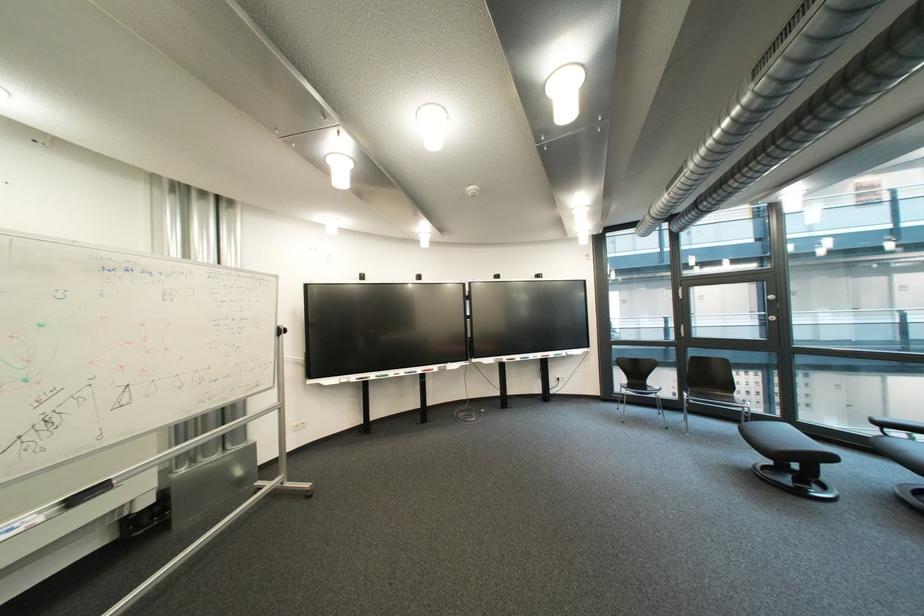
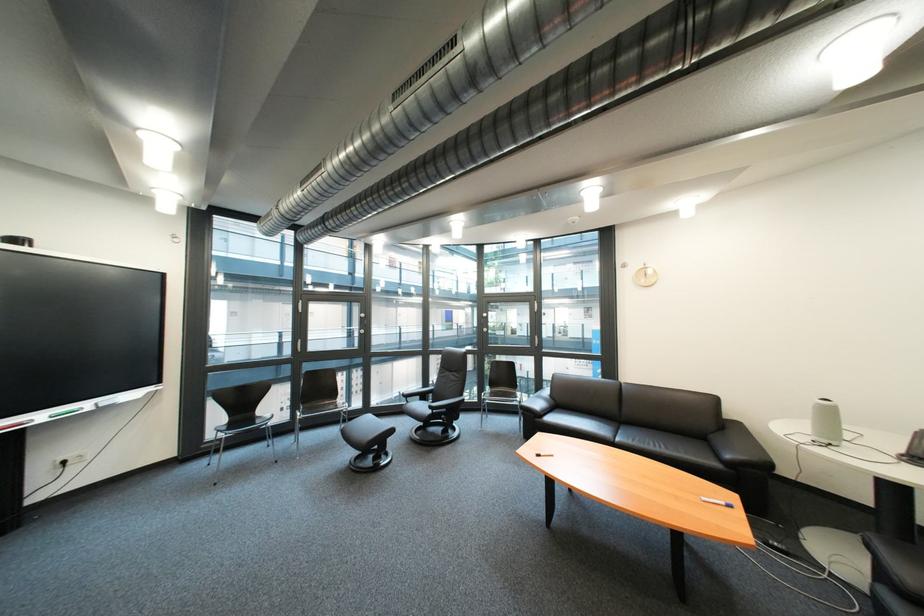
Question: The images are taken continuously from a first-person perspective. In which direction is your viewpoint rotating?

Choices:
 (A) Left
 (B) Right
 (C) Up
 (D) Down

Answer: (B)